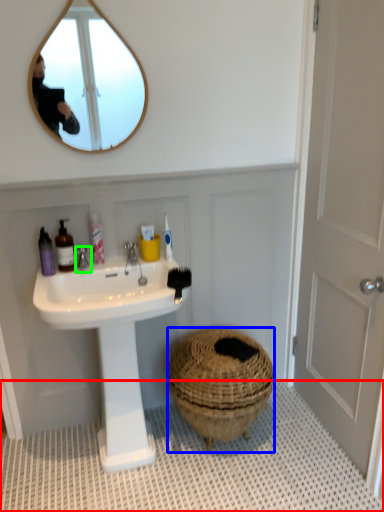
Question: Which is farther away from bath mat (highlighted by a red box)? basket (highlighted by a blue box) or tap (highlighted by a green box)?

Choices:
 (A) basket
 (B) tap

Answer: (B)